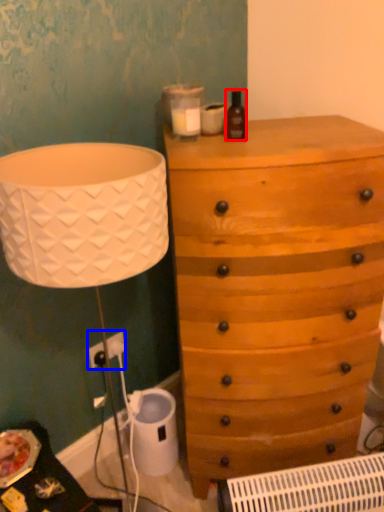
Question: Which object appears closest to the camera in this image, bottle (highlighted by a red box) or electric outlet (highlighted by a blue box)?

Choices:
 (A) bottle
 (B) electric outlet

Answer: (A)